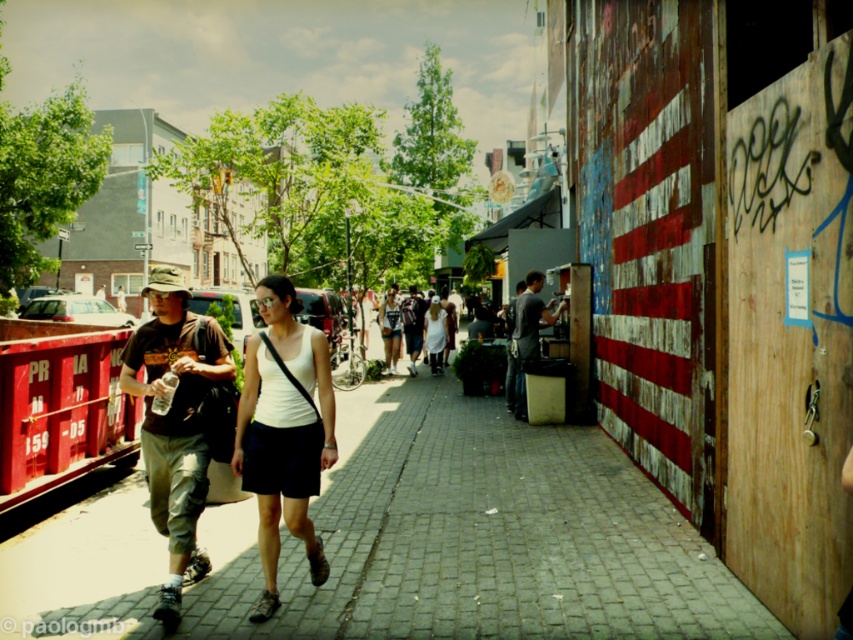
Question: Which object is the farthest from the camouflage fabric hat at left?

Choices:
 (A) dark gray shirt at center
 (B) white cotton dress at center
 (C) white fabric tank top at center

Answer: (B)

Question: Considering the real-world distances, which object is farthest from the white matte tank top at center?

Choices:
 (A) brick pavement at center
 (B) camouflage fabric hat at left

Answer: (B)

Question: Is brick pavement at center further to camera compared to white cotton dress at center?

Choices:
 (A) no
 (B) yes

Answer: (A)

Question: Does white fabric tank top at center have a larger size compared to white cotton dress at center?

Choices:
 (A) yes
 (B) no

Answer: (A)

Question: Based on their relative distances, which object is farther from the brick pavement at center?

Choices:
 (A) camouflage fabric hat at left
 (B) denim shorts at center
 (C) white matte tank top at center

Answer: (C)

Question: Does brick pavement at center appear over dark gray shirt at center?

Choices:
 (A) no
 (B) yes

Answer: (A)